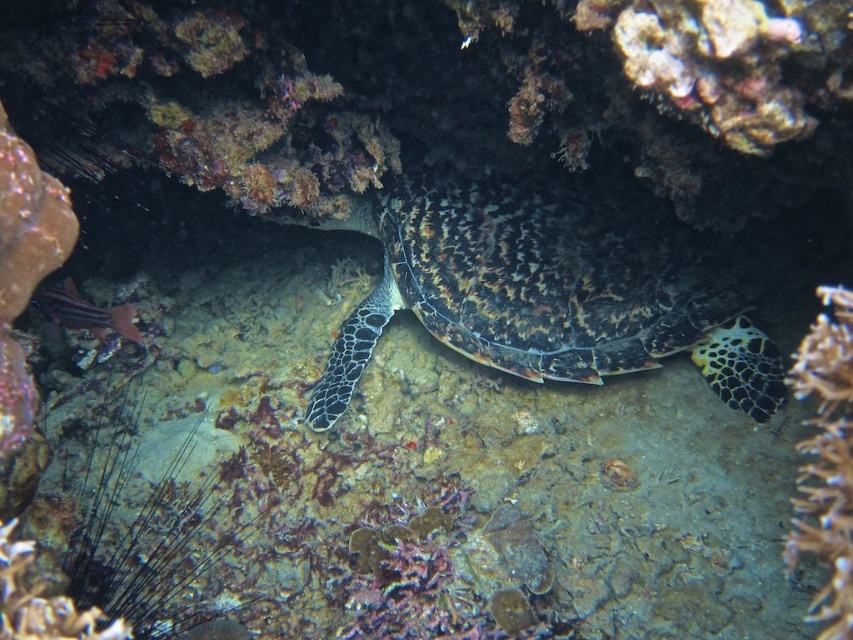
Question: Is translucent white coral at lower right in front of shiny red fish at lower left?

Choices:
 (A) no
 (B) yes

Answer: (B)

Question: Estimate the real-world distances between objects in this image. Which object is farther from the leopard-patterned shell at center?

Choices:
 (A) shiny red fish at lower left
 (B) translucent white coral at lower right

Answer: (A)

Question: Does translucent white coral at lower right have a greater width compared to shiny red fish at lower left?

Choices:
 (A) no
 (B) yes

Answer: (B)

Question: Does leopard-patterned shell at center have a lesser width compared to translucent white coral at lower right?

Choices:
 (A) no
 (B) yes

Answer: (A)

Question: Which object is the closest to the shiny red fish at lower left?

Choices:
 (A) translucent white coral at lower right
 (B) leopard-patterned shell at center

Answer: (B)

Question: Which point appears closest to the camera in this image?

Choices:
 (A) (624, 310)
 (B) (62, 316)
 (C) (843, 481)

Answer: (C)